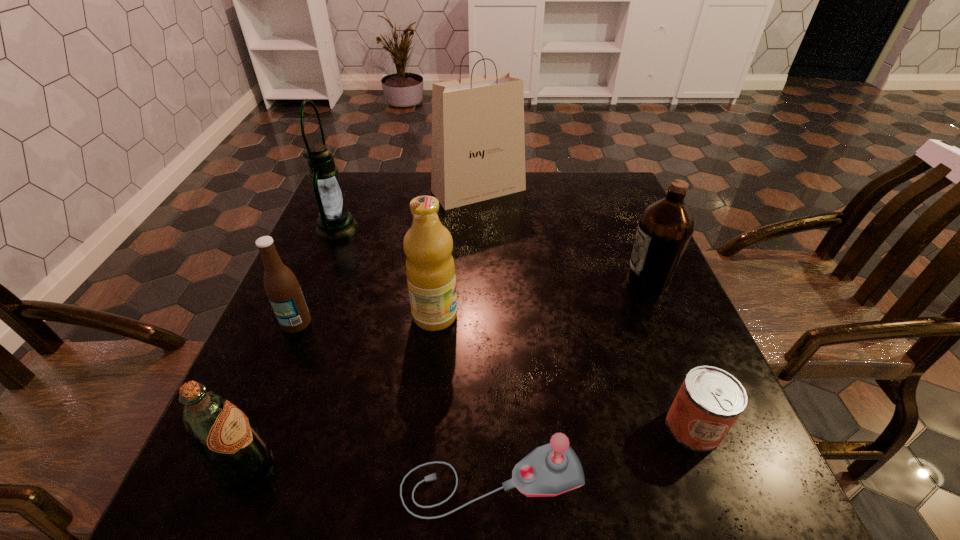
In order to click on vacant area situated 0.220m on the right of the shopping bag in this screenshot , I will do `click(601, 191)`.

In order to click on free spot located 0.060m on the side where the seventh nearest object emits light in this screenshot , I will do [x=381, y=227].

The width and height of the screenshot is (960, 540). Identify the location of free location located 0.330m on the label of the second olive oil from left to right. (616, 316).

Locate an element on the screen. Image resolution: width=960 pixels, height=540 pixels. vacant space located on the label of the sixth nearest object is located at coordinates (602, 280).

Image resolution: width=960 pixels, height=540 pixels. What are the coordinates of `vacant area situated on the label of the sixth nearest object` in the screenshot? It's located at (461, 280).

Locate an element on the screen. The image size is (960, 540). vacant space located 0.080m on the label of the sixth nearest object is located at coordinates (589, 280).

Locate an element on the screen. Image resolution: width=960 pixels, height=540 pixels. blank area located 0.270m on the front of the beer bottle is located at coordinates (236, 467).

This screenshot has width=960, height=540. I want to click on free space located 0.110m on the front-facing side of the shortest olive oil, so coord(342,464).

You are a GUI agent. You are given a task and a screenshot of the screen. Output one action in this format:
    pyautogui.click(x=<x>, y=<y>)
    Task: Click on the vacant space located 0.250m on the back of the can
    This screenshot has height=540, width=960.
    Given the screenshot: What is the action you would take?
    pyautogui.click(x=645, y=301)

Where is `free location located on the right of the joystick`? free location located on the right of the joystick is located at coordinates (661, 480).